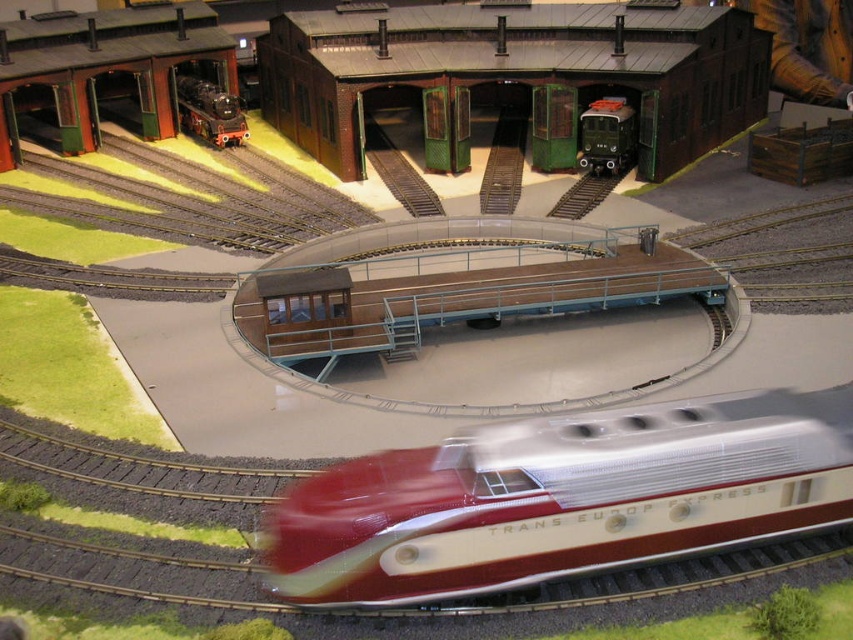
Who is lower down, metallic silver train at center or polished metal locomotive at center-left?

Positioned lower is metallic silver train at center.

Is point (366, 572) positioned behind point (230, 97)?

No, it is in front of (230, 97).

Is point (799, 458) farther from camera compared to point (234, 100)?

No, (799, 458) is in front of (234, 100).

The image size is (853, 640). I want to click on metallic silver train at center, so click(563, 497).

Which is behind, point (604, 122) or point (212, 88)?

The point (212, 88) is more distant.

Is green matte train at center positioned at the back of polished metal locomotive at center-left?

No, it is in front of polished metal locomotive at center-left.

Locate an element on the screen. This screenshot has height=640, width=853. green matte train at center is located at coordinates (607, 136).

Find the location of `green matte train at center`. green matte train at center is located at coordinates (607, 136).

Can you confirm if metallic silver train at center is shorter than green matte train at center?

Yes.

Based on the photo, does metallic silver train at center have a greater width compared to green matte train at center?

Yes, metallic silver train at center is wider than green matte train at center.

This screenshot has width=853, height=640. In order to click on metallic silver train at center in this screenshot , I will do `click(563, 497)`.

You are a GUI agent. You are given a task and a screenshot of the screen. Output one action in this format:
    pyautogui.click(x=<x>, y=<y>)
    Task: Click on the metallic silver train at center
    Image resolution: width=853 pixels, height=640 pixels.
    Given the screenshot: What is the action you would take?
    pyautogui.click(x=563, y=497)